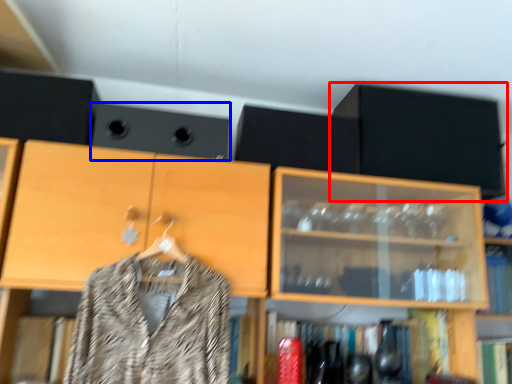
Question: Which object appears farthest to the camera in this image, cabinetry (highlighted by a red box) or speaker (highlighted by a blue box)?

Choices:
 (A) cabinetry
 (B) speaker

Answer: (A)